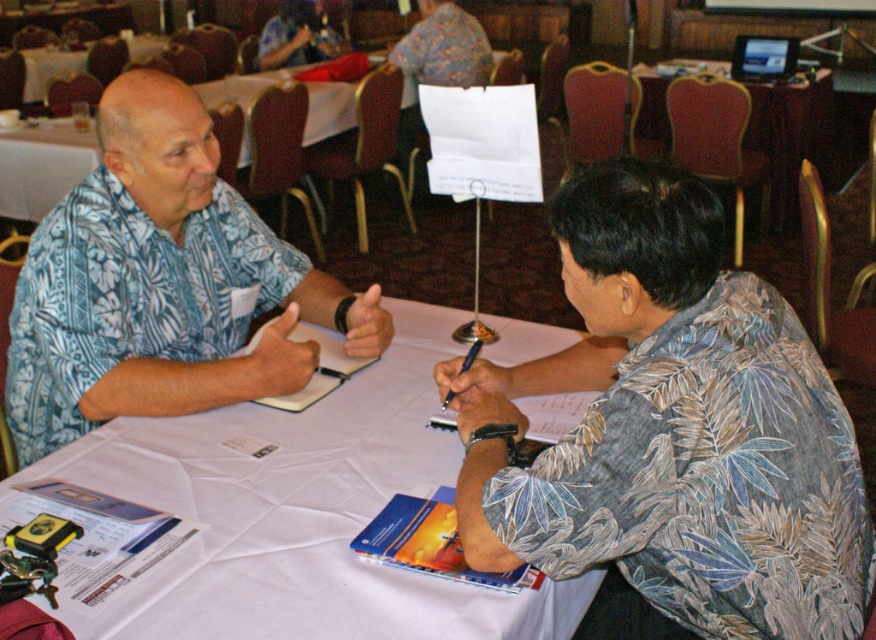
Who is more forward, (278, 529) or (776, 196)?

Point (278, 529) is more forward.

Does white paper table at center have a smaller size compared to wooden table at upper right?

Yes.

Where is `white paper table at center`? The height and width of the screenshot is (640, 876). white paper table at center is located at coordinates (300, 513).

Between printed fabric shirt at center and wooden table at upper right, which one has less height?

With less height is printed fabric shirt at center.

Does printed fabric shirt at center have a greater width compared to wooden table at upper right?

No.

Where is `printed fabric shirt at center`? The height and width of the screenshot is (640, 876). printed fabric shirt at center is located at coordinates (670, 433).

Can you confirm if white paper table at center is positioned to the right of blue floral shirt at left?

Yes, white paper table at center is to the right of blue floral shirt at left.

Is point (170, 634) farther from viewer compared to point (359, 340)?

No, it is not.

At what (x,y) coordinates should I click in order to perform the action: click on white paper table at center. Please return your answer as a coordinate pair (x, y). This screenshot has width=876, height=640. Looking at the image, I should click on (300, 513).